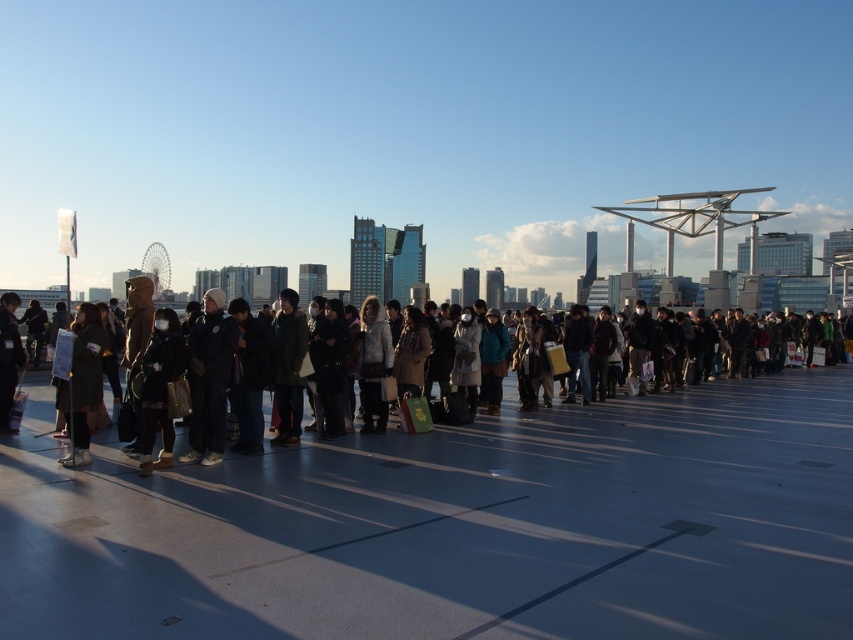
You are a photographer trying to capture a clear photo of the dark gray fabric jacket at center without the dark green fabric coat at left blocking it. Based on the scene description, what should you do?

The dark green fabric coat at left is behind the dark gray fabric jacket at center, so you can move closer to the dark gray fabric jacket at center to ensure the dark green fabric coat at left is out of frame or adjust your angle to avoid capturing it behind the jacket.

You are standing in the plaza and want to walk towards the Ferris wheel in the background. There are two points marked on the ground ahead of you at coordinates point (195, 369) and point (94, 412). Which point should you step on first to reach the Ferris wheel more directly?

You should step on point (195, 369) first because it is closer to the viewer, meaning it is on the path leading directly toward the Ferris wheel.

You are a photographer standing at the edge of the plaza. You want to take a photo of the dark gray coat at center without including any people behind it. The Ferris wheel is behind the coat. Can you step back far enough to frame the coat while excluding the Ferris wheel?

The dark gray coat at center is 3.78 meters away from the camera. Since the Ferris wheel is behind the coat, stepping back might allow you to frame the coat while excluding the Ferris wheel, but this depends on the camera lens and your positioning. However, based on the given distance alone, there is no guarantee. You would need to adjust your position or use a telephoto lens to isolate the coat.